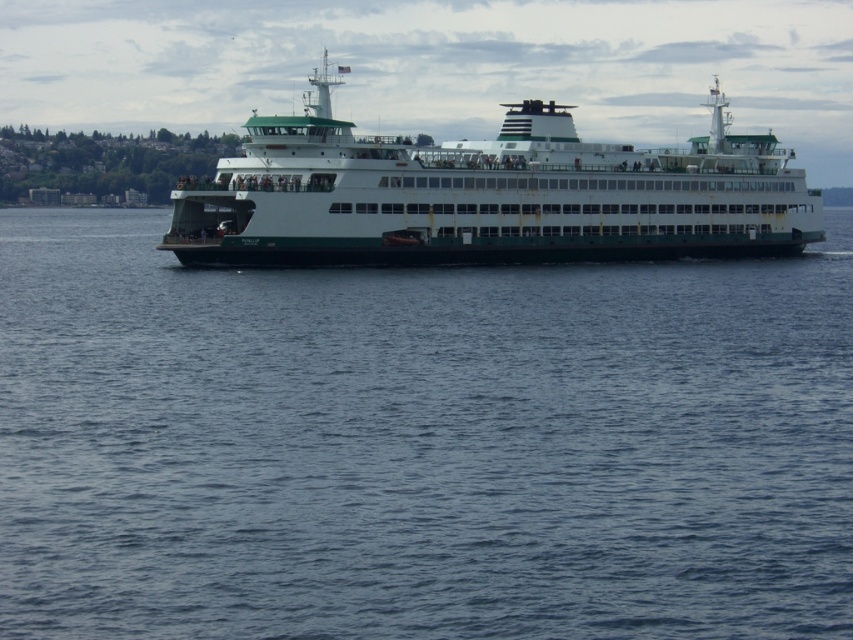
You are a photographer trying to capture the ferry and the water in the image. Since you want to focus on the ferry, which object should you frame more prominently in your shot, the blue water at center or the white matte ferry at center?

The white matte ferry at center should be framed more prominently because the blue water at center has a lesser width compared to the white matte ferry at center, making the ferry a larger and more dominant subject in the scene.

You are a passenger on the ferry and want to know which object between the blue water at center and the white matte ferry at center is lower in height. Can you tell me?

The blue water at center has a lesser height compared to the white matte ferry at center, so the blue water at center is lower in height.

You are standing on the deck of the white matte ferry at center and want to look at the blue water at center. In which direction should you turn your head to see it?

The blue water at center is to the left of the white matte ferry at center, so you should turn your head to the left to see it.